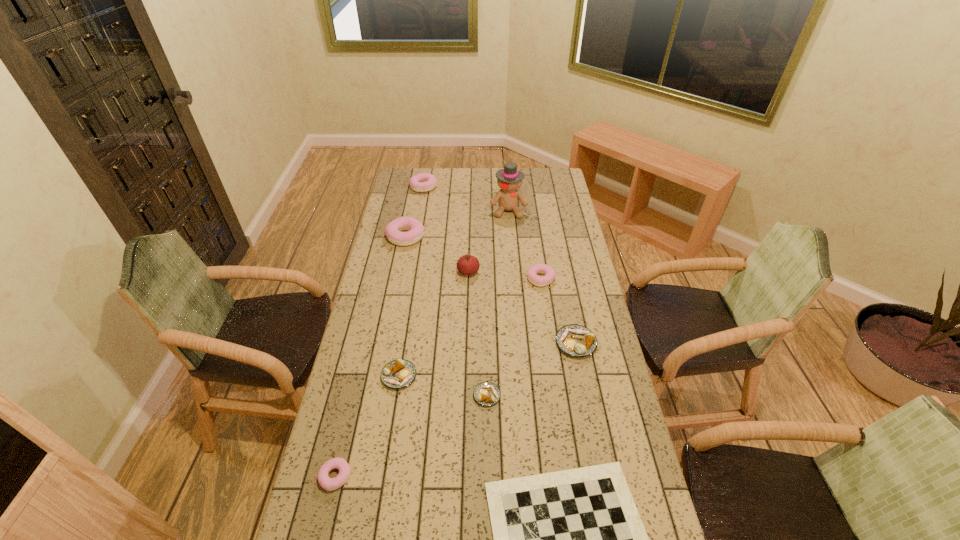
The image size is (960, 540). What are the coordinates of `the third biggest pink pastry` in the screenshot? It's located at (532, 272).

The image size is (960, 540). What are the coordinates of `the fifth nearest pastry` in the screenshot? It's located at click(x=532, y=272).

The image size is (960, 540). What are the coordinates of `the leftmost brown pastry` in the screenshot? It's located at (400, 373).

Locate an element on the screen. This screenshot has width=960, height=540. the nearest pink pastry is located at coordinates (327, 483).

The width and height of the screenshot is (960, 540). I want to click on the nearest pastry, so click(327, 483).

Image resolution: width=960 pixels, height=540 pixels. I want to click on the second brown pastry from left to right, so click(486, 393).

Find the location of a particular element. This screenshot has width=960, height=540. the third pastry from right to left is located at coordinates (486, 393).

At what (x,y) coordinates should I click in order to perform the action: click on vacant space located on the front-facing side of the tallest object. Please return your answer as a coordinate pair (x, y). Looking at the image, I should click on (510, 230).

What are the coordinates of `vacant space situated 0.090m on the left of the red tomato` in the screenshot? It's located at (436, 272).

Where is `free region located on the right of the second farthest pastry`? This screenshot has height=540, width=960. free region located on the right of the second farthest pastry is located at coordinates (481, 237).